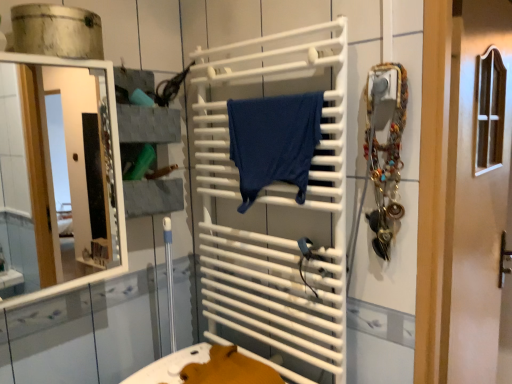
Question: Considering the relative positions of white glossy door at center and white matte towel rack at center in the image provided, is white glossy door at center to the left of white matte towel rack at center from the viewer's perspective?

Choices:
 (A) yes
 (B) no

Answer: (B)

Question: Can you see white glossy door at center touching white matte towel rack at center?

Choices:
 (A) no
 (B) yes

Answer: (A)

Question: Is white glossy door at center positioned with its back to white matte towel rack at center?

Choices:
 (A) yes
 (B) no

Answer: (B)

Question: Would you consider white glossy door at center to be distant from white matte towel rack at center?

Choices:
 (A) no
 (B) yes

Answer: (A)

Question: Is white glossy door at center bigger than white matte towel rack at center?

Choices:
 (A) yes
 (B) no

Answer: (A)

Question: Relative to metallic silver jewelry at right, is dark blue fabric at center in front or behind?

Choices:
 (A) front
 (B) behind

Answer: (B)

Question: Do you think dark blue fabric at center is within metallic silver jewelry at right, or outside of it?

Choices:
 (A) inside
 (B) outside

Answer: (B)

Question: In the image, is dark blue fabric at center on the left side or the right side of metallic silver jewelry at right?

Choices:
 (A) left
 (B) right

Answer: (A)

Question: Considering the positions of dark blue fabric at center and metallic silver jewelry at right in the image, is dark blue fabric at center bigger or smaller than metallic silver jewelry at right?

Choices:
 (A) small
 (B) big

Answer: (B)

Question: Is white glossy mirror at left inside the boundaries of white matte towel rack at center, or outside?

Choices:
 (A) inside
 (B) outside

Answer: (B)

Question: From their relative heights in the image, would you say white glossy mirror at left is taller or shorter than white matte towel rack at center?

Choices:
 (A) tall
 (B) short

Answer: (B)

Question: Visually, is white glossy mirror at left positioned to the left or to the right of white matte towel rack at center?

Choices:
 (A) right
 (B) left

Answer: (B)

Question: From a real-world perspective, is white glossy mirror at left positioned above or below white matte towel rack at center?

Choices:
 (A) below
 (B) above

Answer: (B)

Question: Based on their positions, is white glossy door at center located to the left or right of dark blue fabric at center?

Choices:
 (A) right
 (B) left

Answer: (A)

Question: Is white glossy door at center wider or thinner than dark blue fabric at center?

Choices:
 (A) thin
 (B) wide

Answer: (B)